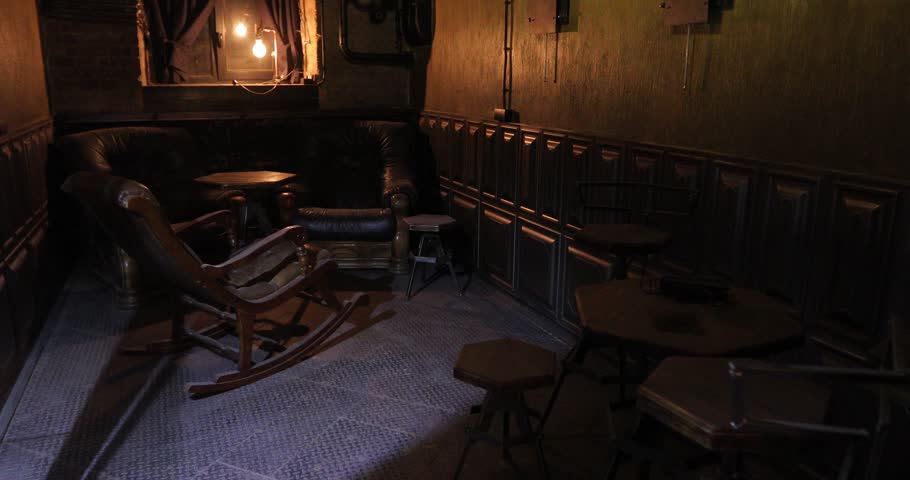
You are a GUI agent. You are given a task and a screenshot of the screen. Output one action in this format:
    pyautogui.click(x=<x>, y=<y>)
    Task: Click on the light
    
    Given the screenshot: What is the action you would take?
    pyautogui.click(x=239, y=29)